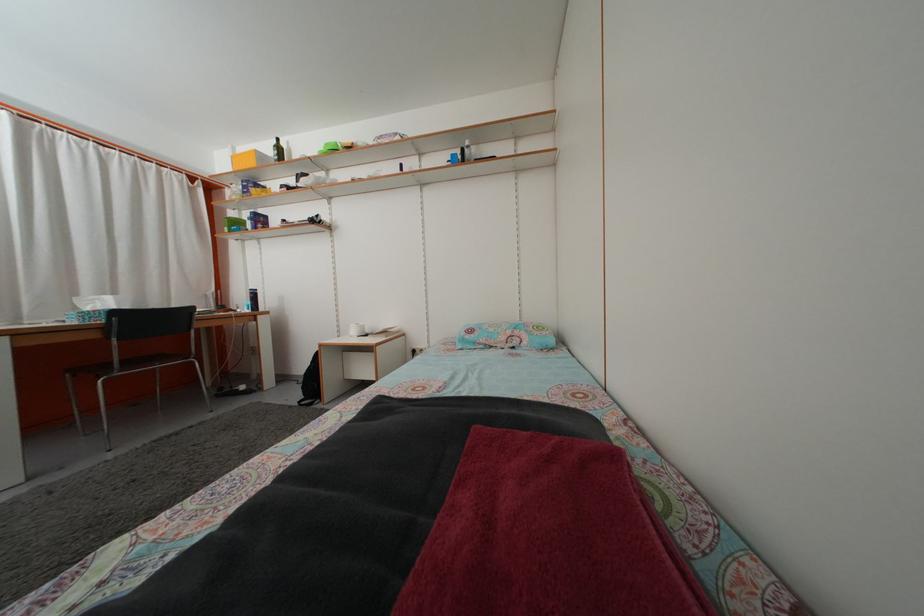
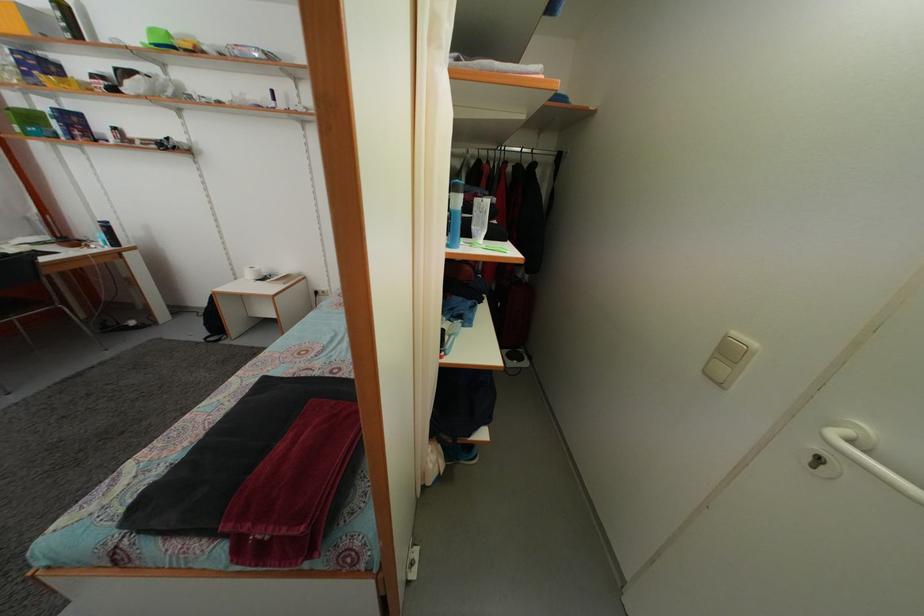
Which direction would the cameraman need to move to produce the second image?

The cameraman walked toward right, backward.